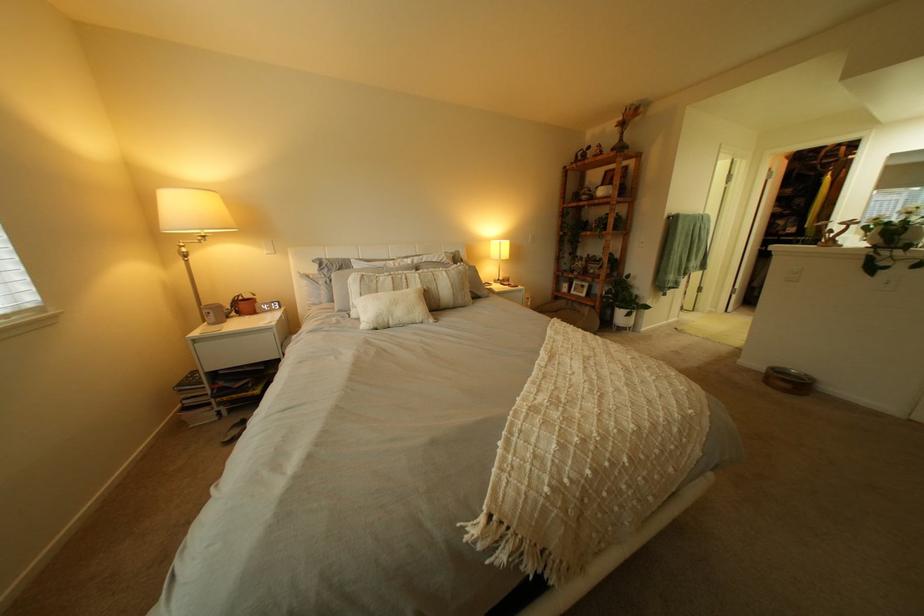
Find where to lift the white textured pillow. Please return your answer as a coordinate pair (x, y).

(390, 315)